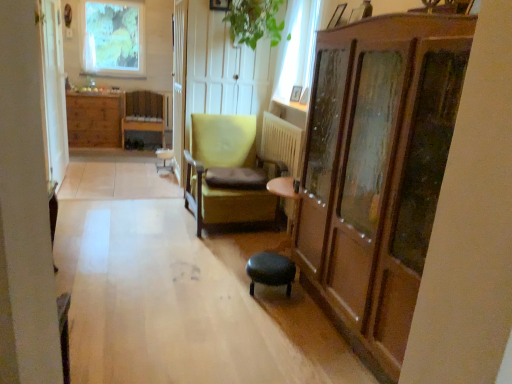
Question: Considering their positions, is green fabric bar stool at center located in front of or behind metallic silver picture frame at upper right, the 2th picture frame positioned from the bottom?

Choices:
 (A) front
 (B) behind

Answer: (B)

Question: In terms of width, does green fabric bar stool at center look wider or thinner when compared to metallic silver picture frame at upper right, the 2th picture frame viewed from the top?

Choices:
 (A) wide
 (B) thin

Answer: (A)

Question: Which object is positioned closest to the matte yellow armchair at center, positioned as the 1th chair in bottom-to-top order?

Choices:
 (A) green matte window at upper left, the second window in the front-to-back sequence
 (B) green fabric bar stool at center
 (C) wooden picture frame at upper center, which ranks as the second picture frame in back-to-front order
 (D) black leather stool at center
 (E) white glass window at upper center, which appears as the 2th window when viewed from the top

Answer: (E)

Question: Based on their relative distances, which object is farther from the green fabric bar stool at center?

Choices:
 (A) green matte window at upper left, positioned as the second window in right-to-left order
 (B) green leafy plant at upper center
 (C) matte yellow armchair at center, which ranks as the second chair in left-to-right order
 (D) white glass window at upper center, which ranks as the second window in back-to-front order
 (E) white wooden screen door at center, acting as the second screen door starting from the left

Answer: (A)